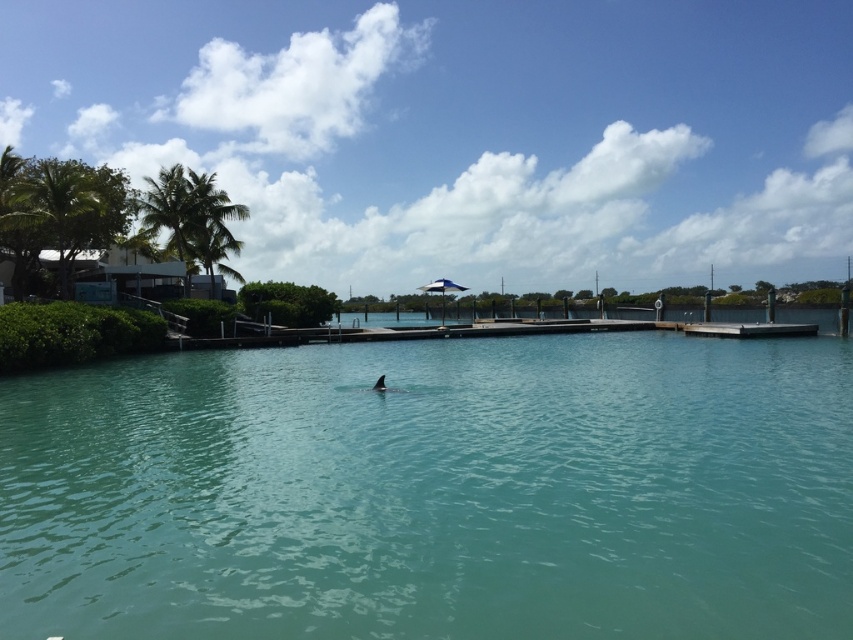
You are planning to install a solar panel between the green leafy palm tree at upper left and the green leafy palm tree at left. The solar panel requires at least 5 meters of space between the trees to be installed. Based on the scene, can you determine if there is enough space between the two palm trees for the solar panel installation?

The green leafy palm tree at upper left and green leafy palm tree at left are 7.24 meters apart, which is more than the required 5 meters. Therefore, there is enough space between them to install the solar panel.

You are a visitor standing on the wooden dock and want to take a photo of the clear blue water at center and the green leafy palm tree at left. Which object is closer to you, the photographer, based on their positions in the scene?

The clear blue water at center is positioned under the green leafy palm tree at left, meaning the palm tree is closer to you since it is above the water in the frame.

You are standing at the edge of the dock and see two points marked in the water. The first point is at coordinates point (523, 529) and the second is at point (225, 220). Which point is closer to you from your current position?

Point (523, 529) is in front of point (225, 220), so the first point is closer to you.